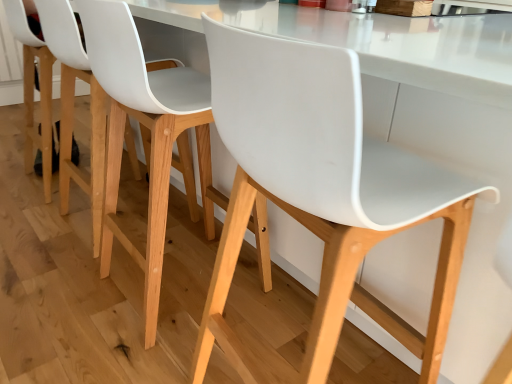
Question: Considering the relative sizes of white matte plastic chair at center, which is the 1th chair in right-to-left order, and white plastic chair at center, acting as the 2th chair starting from the right, in the image provided, is white matte plastic chair at center, which is the 1th chair in right-to-left order, wider than white plastic chair at center, acting as the 2th chair starting from the right,?

Choices:
 (A) no
 (B) yes

Answer: (B)

Question: Can you confirm if white matte plastic chair at center, positioned as the 2th chair in left-to-right order, is positioned to the left of white plastic chair at center, acting as the 2th chair starting from the right?

Choices:
 (A) yes
 (B) no

Answer: (B)

Question: From a real-world perspective, is white matte plastic chair at center, positioned as the 2th chair in left-to-right order, located higher than white plastic chair at center, which is counted as the 1th chair, starting from the left?

Choices:
 (A) yes
 (B) no

Answer: (A)

Question: From a real-world perspective, is white matte plastic chair at center, which is the 1th chair in right-to-left order, physically below white plastic chair at center, which is counted as the 1th chair, starting from the left?

Choices:
 (A) yes
 (B) no

Answer: (B)

Question: Does white matte plastic chair at center, which is the 1th chair in right-to-left order, have a greater height compared to white plastic chair at center, which is counted as the 1th chair, starting from the left?

Choices:
 (A) no
 (B) yes

Answer: (B)

Question: Is white matte plastic chair at center, which is the 1th chair in right-to-left order, directly adjacent to white plastic chair at center, acting as the 2th chair starting from the right?

Choices:
 (A) yes
 (B) no

Answer: (B)

Question: Is white plastic chair at center, which is counted as the 1th chair, starting from the left, positioned with its back to white matte plastic chair at center, positioned as the 2th chair in left-to-right order?

Choices:
 (A) yes
 (B) no

Answer: (B)

Question: From the image's perspective, is white plastic chair at center, which is counted as the 1th chair, starting from the left, under white matte plastic chair at center, positioned as the 2th chair in left-to-right order?

Choices:
 (A) no
 (B) yes

Answer: (A)

Question: From the image's perspective, would you say white plastic chair at center, acting as the 2th chair starting from the right, is positioned over white matte plastic chair at center, positioned as the 2th chair in left-to-right order?

Choices:
 (A) no
 (B) yes

Answer: (B)

Question: Does white plastic chair at center, acting as the 2th chair starting from the right, have a smaller size compared to white matte plastic chair at center, positioned as the 2th chair in left-to-right order?

Choices:
 (A) yes
 (B) no

Answer: (B)

Question: Does white plastic chair at center, acting as the 2th chair starting from the right, have a lesser width compared to white matte plastic chair at center, positioned as the 2th chair in left-to-right order?

Choices:
 (A) yes
 (B) no

Answer: (A)

Question: Does white plastic chair at center, which is counted as the 1th chair, starting from the left, appear on the right side of white matte plastic chair at center, positioned as the 2th chair in left-to-right order?

Choices:
 (A) yes
 (B) no

Answer: (B)

Question: Is white plastic chair at center, which is counted as the 1th chair, starting from the left, in front of or behind white matte plastic chair at center, positioned as the 2th chair in left-to-right order, in the image?

Choices:
 (A) front
 (B) behind

Answer: (B)